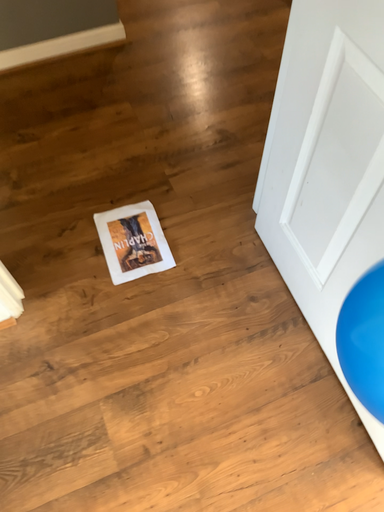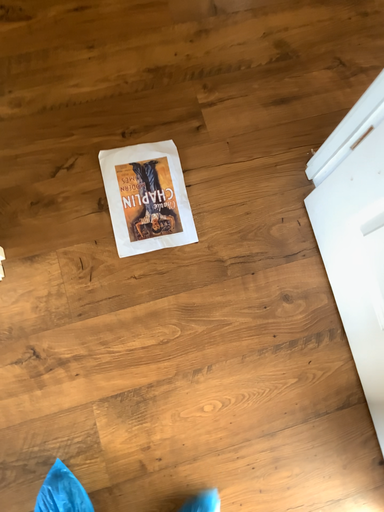
Question: Which way did the camera rotate in the video?

Choices:
 (A) rotated upward
 (B) rotated downward

Answer: (B)